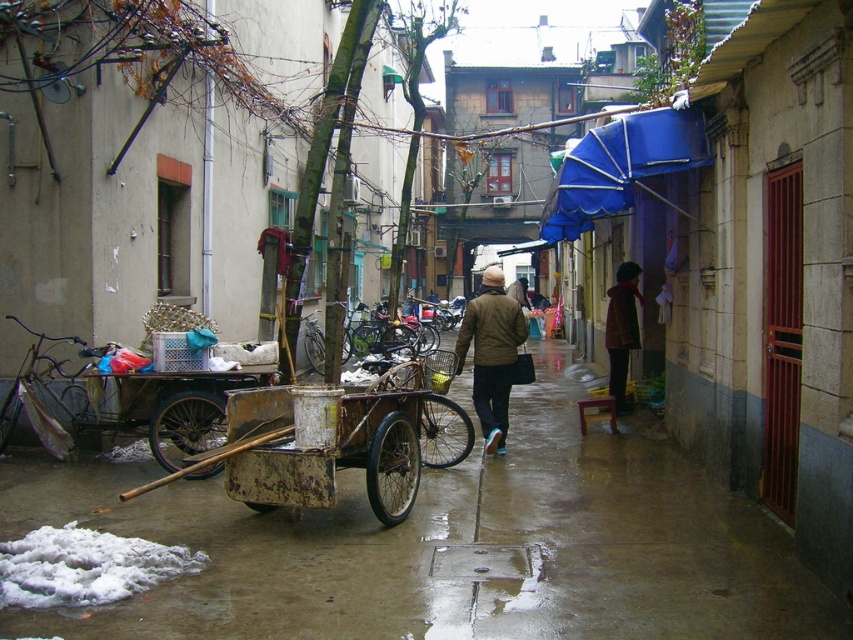
Question: Can you confirm if rusty metal tricycle at left is bigger than rusty metal bicycle at center?

Choices:
 (A) no
 (B) yes

Answer: (A)

Question: Does wet concrete pavement at lower left have a smaller size compared to brown woolen coat at right?

Choices:
 (A) yes
 (B) no

Answer: (B)

Question: Which of the following is the closest to the observer?

Choices:
 (A) (90, 417)
 (B) (277, 461)

Answer: (B)

Question: From the image, what is the correct spatial relationship of brown matte jacket at center in relation to brown woolen coat at right?

Choices:
 (A) right
 (B) left

Answer: (B)

Question: Which is farther from the rusty metal bicycle at center?

Choices:
 (A) brown matte jacket at center
 (B) blue fabric umbrella at upper center
 (C) brown woolen coat at right

Answer: (C)

Question: Which point is farther to the camera?

Choices:
 (A) rusty metal tricycle at left
 (B) rusty metal bicycle at center
 (C) wet concrete pavement at lower left

Answer: (A)